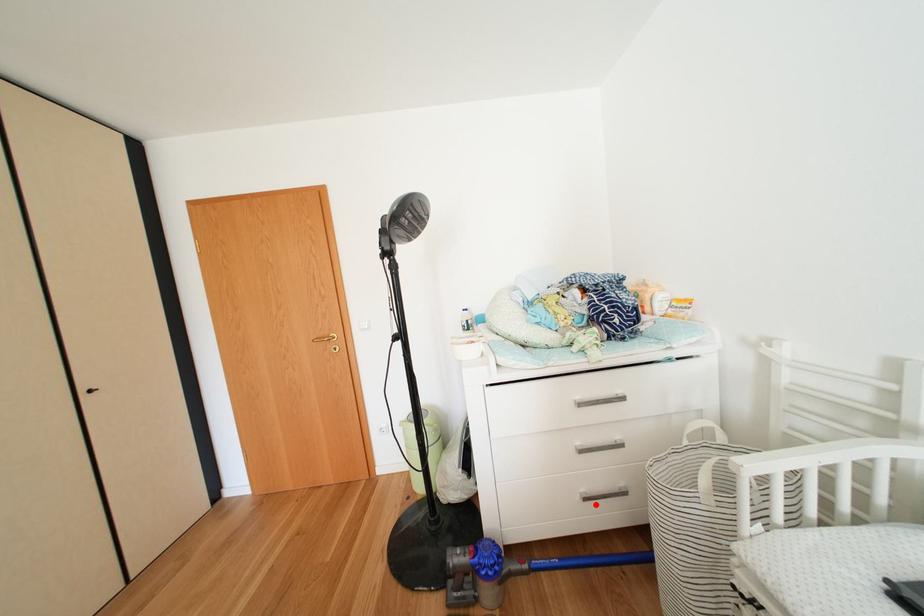
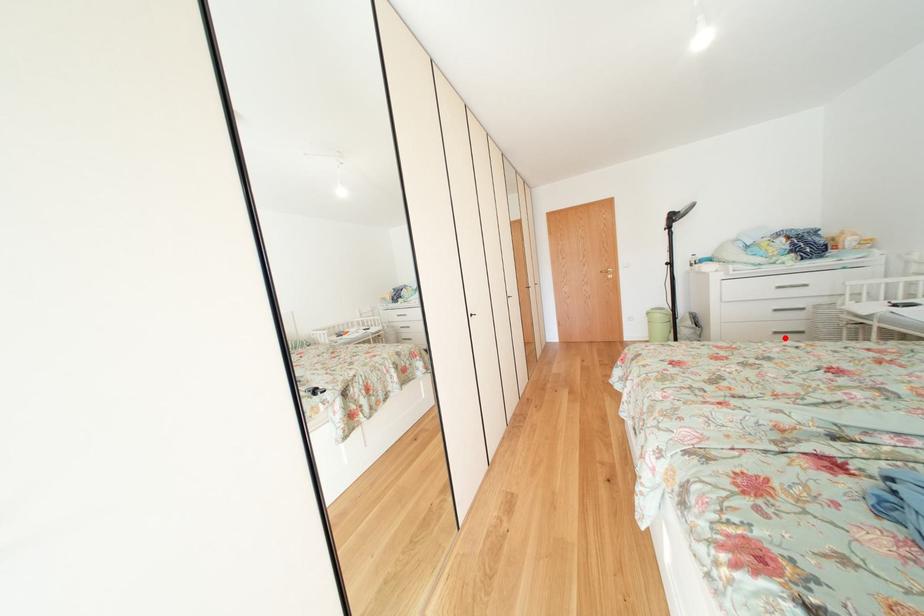
I am providing you with two images of the same scene from different viewpoints. A red point is marked on the first image and another point is marked on the second image. Are the points marked in image1 and image2 representing the same 3D position?

Yes